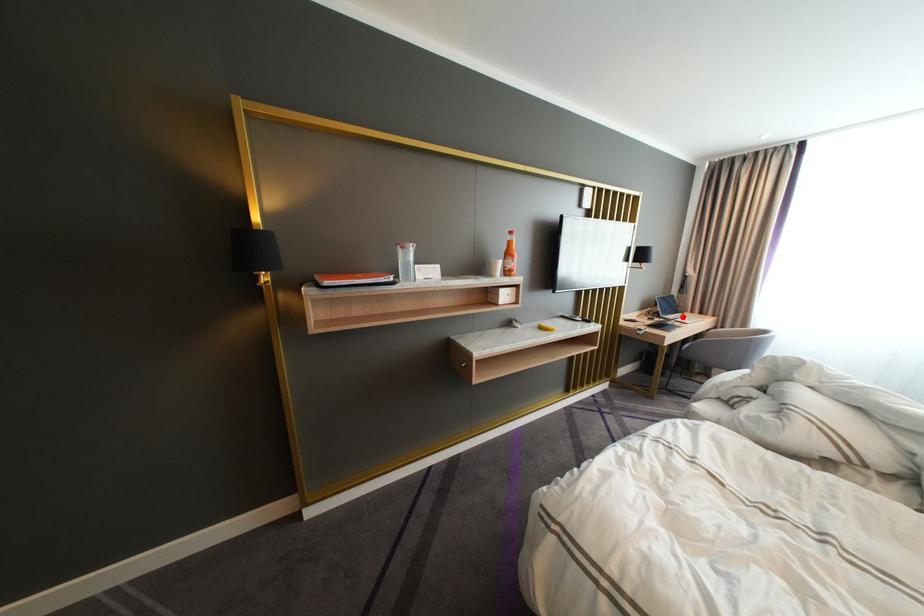
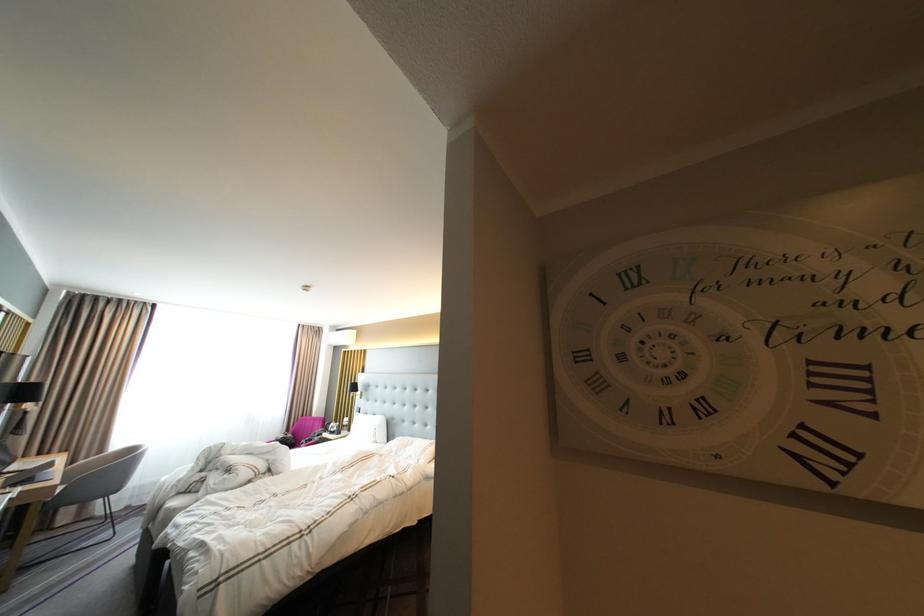
Question: I am providing you with two images of the same scene from different viewpoints. Image1 has a red point marked. In image2, the corresponding 3D location appears at what relative position? Reply with the corresponding letter.

Choices:
 (A) Closer
 (B) Farther

Answer: (B)